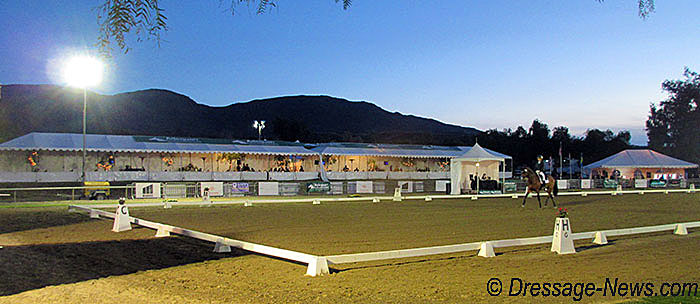
Find the location of a particular element. The width and height of the screenshot is (700, 304). light is located at coordinates (84, 71).